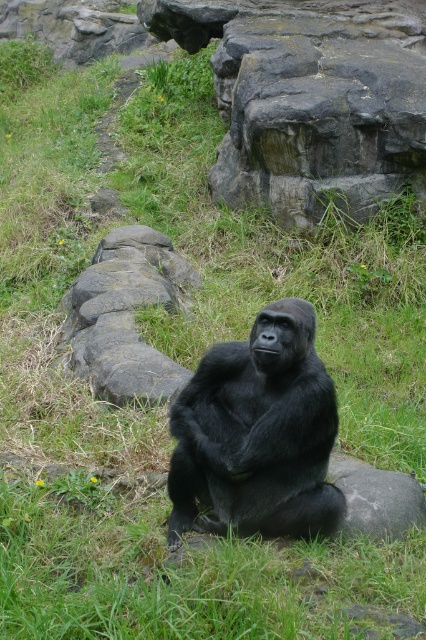
You are a visitor at the zoo and want to take a photo of the black fur gorilla at center without any obstructions. However, the rough textured rock at upper center is blocking your view. Can you move to a position where you can see the entire gorilla without the rock blocking it?

The black fur gorilla at center is behind the rough textured rock at upper center, so moving around to a position where the rock is no longer between you and the gorilla would allow you to see the entire gorilla without obstruction.

You are a visitor at the zoo and want to take a photo of the black fur gorilla at center and the gray rough stone at center. Which object is positioned lower in the image?

The black fur gorilla at center is positioned below the gray rough stone at center, so it is lower in the image.

You are a zookeeper observing the gorilla in the image. You notice a rough textured rock at upper center marked at point [308,99]. Where would you direct a visitor to look to find this rock?

The rough textured rock at upper center is located at point [308,99], so you should direct visitors to look at the upper center area of the image to find the rock.